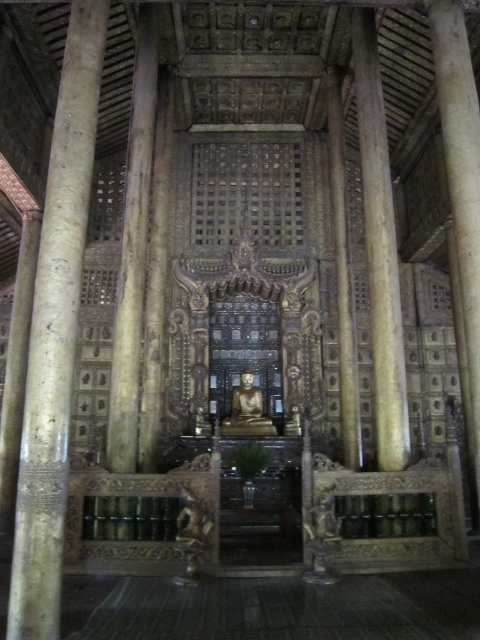
You are standing in the temple and notice two central structures, the wooden carved column at center and the carved wood pillar at center. Which one is located to the left when facing the Buddha statue?

The wooden carved column at center is positioned on the left side of the carved wood pillar at center, so it is located to the left when facing the Buddha statue.

You are standing in the temple and want to take a photo of the wooden carved column at center. If your camera has a maximum focus range of 70 feet, will it be able to capture the column clearly?

The wooden carved column at center and camera are 71.25 feet apart from each other. Since the distance exceeds the camera maximum focus range of 70 feet, the camera cannot capture the column clearly.

You are an architect examining the temple interior. You notice two central structures, the wooden carved column at center and the carved wood pillar at center. Which one is bigger in size?

The wooden carved column at center is larger in size compared to the carved wood pillar at center.